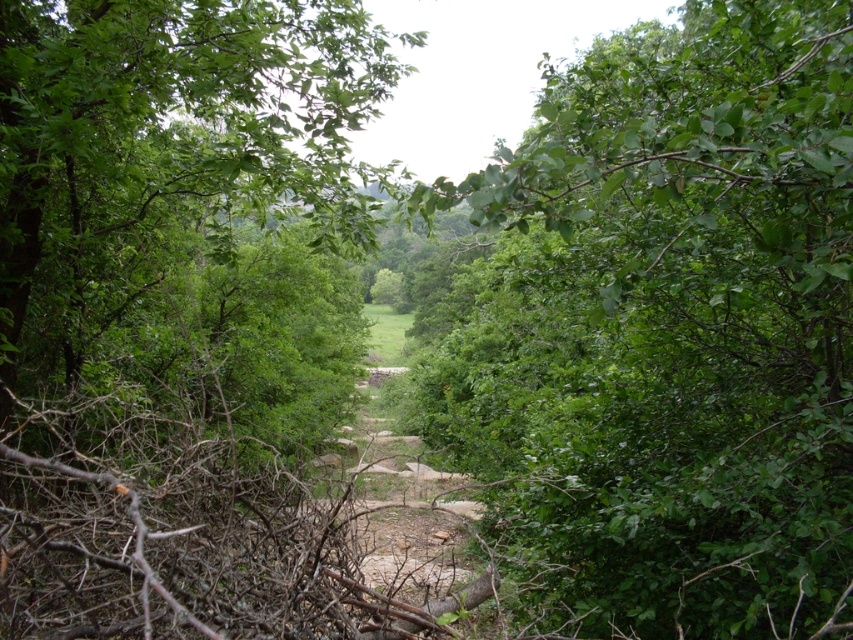
Question: Can you confirm if green leafy bush at center is smaller than green leafy tree at center?

Choices:
 (A) no
 (B) yes

Answer: (B)

Question: Can you confirm if green leafy bush at center is positioned to the left of green leafy tree at center?

Choices:
 (A) yes
 (B) no

Answer: (B)

Question: Which point appears farthest from the camera in this image?

Choices:
 (A) (61, 180)
 (B) (704, 225)

Answer: (A)

Question: In this image, where is green leafy bush at center located relative to green leafy tree at center?

Choices:
 (A) right
 (B) left

Answer: (A)

Question: Among these points, which one is farthest from the camera?

Choices:
 (A) (654, 392)
 (B) (294, 108)

Answer: (A)

Question: Which of the following is the farthest from the observer?

Choices:
 (A) (70, 12)
 (B) (732, 115)

Answer: (A)